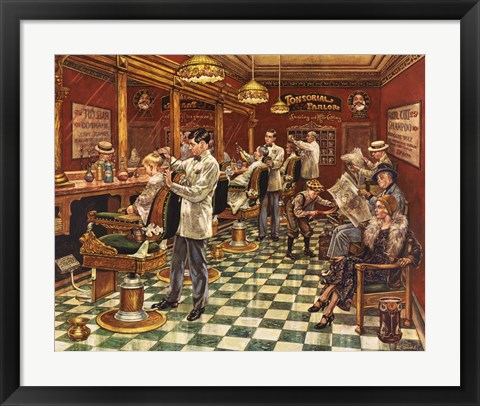
Where is `lights`? This screenshot has width=480, height=406. lights is located at coordinates (211, 64), (252, 97), (279, 106).